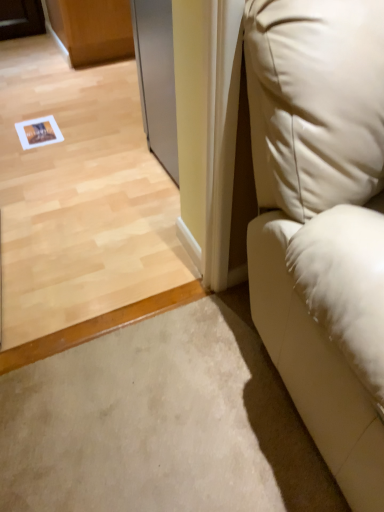
You are a GUI agent. You are given a task and a screenshot of the screen. Output one action in this format:
    pyautogui.click(x=<x>, y=<y>)
    Task: Click on the vacant area situated to the left side of silver metallic screen door at upper center
    
    Given the screenshot: What is the action you would take?
    pyautogui.click(x=115, y=162)